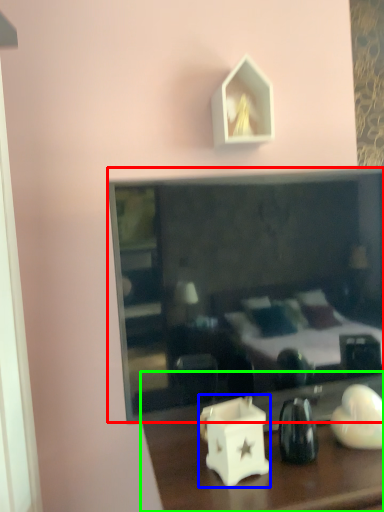
Question: Considering the real-world distances, which object is closest to mirror (highlighted by a red box)? candle holder (highlighted by a blue box) or table (highlighted by a green box).

Choices:
 (A) candle holder
 (B) table

Answer: (B)